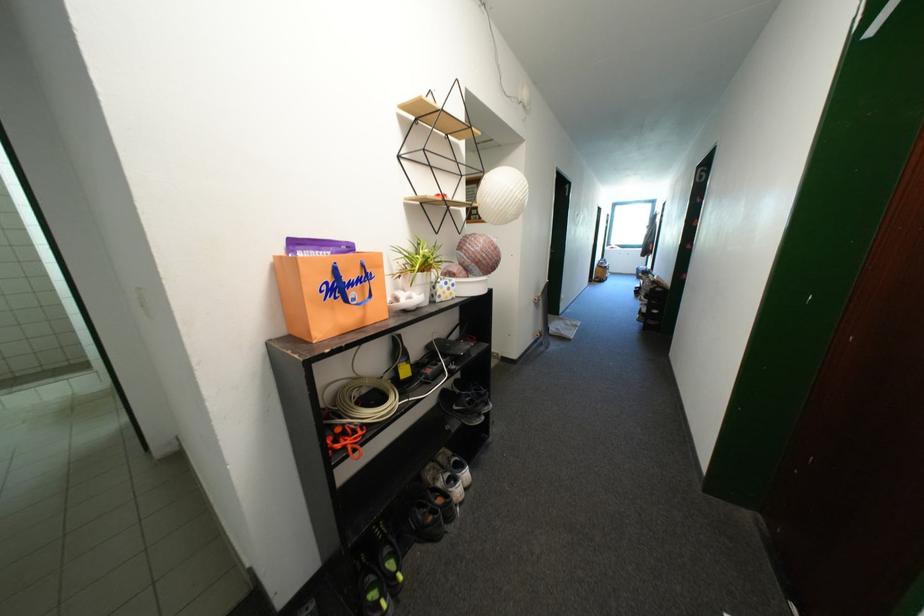
I want to click on blue bag handle, so click(346, 286).